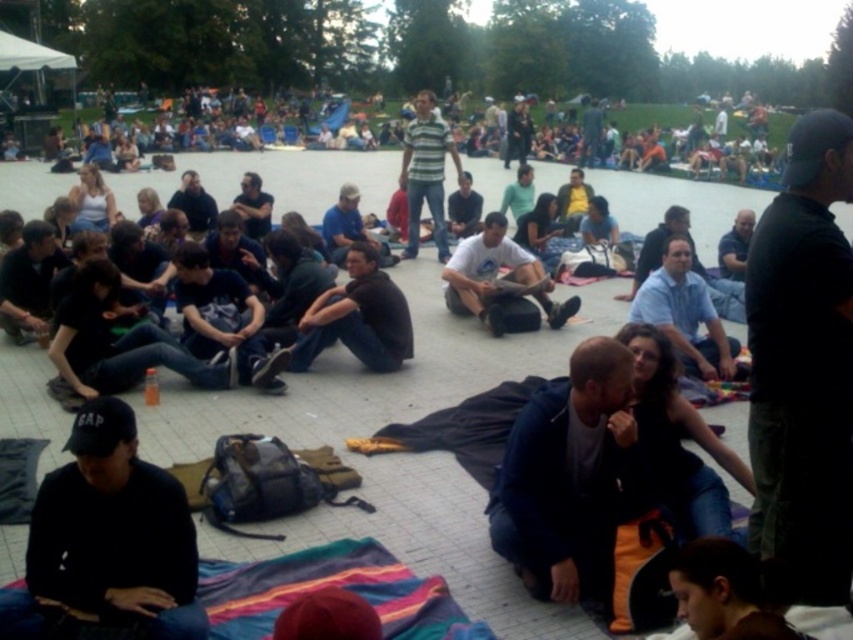
Find the location of a particular element. This screenshot has width=853, height=640. black matte cap at lower left is located at coordinates (107, 540).

How much distance is there between black matte cap at lower left and black matte shirt at center?

black matte cap at lower left is 3.66 meters from black matte shirt at center.

Does black matte cap at lower left appear on the left side of black matte shirt at center?

Indeed, black matte cap at lower left is positioned on the left side of black matte shirt at center.

Who is more forward, [73,556] or [299,330]?

Point [73,556]

The width and height of the screenshot is (853, 640). Identify the location of black matte cap at lower left. (107, 540).

Does dark blue jacket at lower center have a greater width compared to white cotton t-shirt at center?

Incorrect, dark blue jacket at lower center's width does not surpass white cotton t-shirt at center's.

Which of these two, dark blue jacket at lower center or white cotton t-shirt at center, stands taller?

dark blue jacket at lower center is taller.

Image resolution: width=853 pixels, height=640 pixels. Describe the element at coordinates (566, 477) in the screenshot. I see `dark blue jacket at lower center` at that location.

You are a GUI agent. You are given a task and a screenshot of the screen. Output one action in this format:
    pyautogui.click(x=<x>, y=<y>)
    Task: Click on the dark blue jacket at lower center
    The height and width of the screenshot is (640, 853).
    Given the screenshot: What is the action you would take?
    pyautogui.click(x=566, y=477)